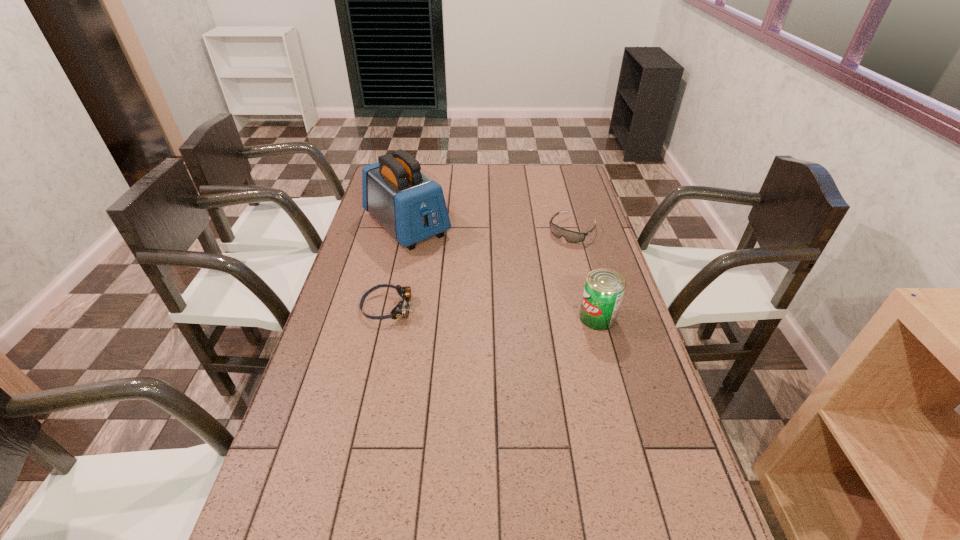
Locate which object ranks in proximity to the right goggles. Please provide its 2D coordinates. Your answer should be formatted as a tuple, i.e. [(x, y)], where the tuple contains the x and y coordinates of a point satisfying the conditions above.

[(604, 288)]

Identify which object is the third closest to the farther goggles. Please provide its 2D coordinates. Your answer should be formatted as a tuple, i.e. [(x, y)], where the tuple contains the x and y coordinates of a point satisfying the conditions above.

[(402, 309)]

The height and width of the screenshot is (540, 960). Identify the location of free space that satisfies the following two spatial constraints: 1. on the front side of the toaster; 2. on the left side of the farther goggles. (405, 230).

The image size is (960, 540). Identify the location of free space that satisfies the following two spatial constraints: 1. on the front side of the second tallest object; 2. on the left side of the right goggles. (596, 318).